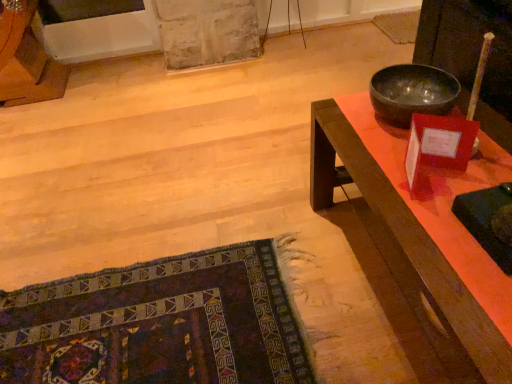
The image size is (512, 384). I want to click on wooden desk at right, so [x=424, y=232].

The height and width of the screenshot is (384, 512). Describe the element at coordinates (160, 324) in the screenshot. I see `dark woven rug at lower left` at that location.

Image resolution: width=512 pixels, height=384 pixels. I want to click on wooden desk at right, so click(x=424, y=232).

Can you tell me how much dark woven rug at lower left and shiny metallic bowl at upper right differ in facing direction?

The angle between the facing direction of dark woven rug at lower left and the facing direction of shiny metallic bowl at upper right is 179 degrees.

Would you consider dark woven rug at lower left to be distant from shiny metallic bowl at upper right?

No, dark woven rug at lower left is in close proximity to shiny metallic bowl at upper right.

Is dark woven rug at lower left bigger or smaller than shiny metallic bowl at upper right?

In the image, dark woven rug at lower left appears to be larger than shiny metallic bowl at upper right.

From the picture: Considering the sizes of dark woven rug at lower left and shiny metallic bowl at upper right in the image, is dark woven rug at lower left wider or thinner than shiny metallic bowl at upper right?

Considering their sizes, dark woven rug at lower left looks broader than shiny metallic bowl at upper right.

Consider the image. How many degrees apart are the facing directions of shiny metallic bowl at upper right and dark woven rug at lower left?

They differ by 179 degrees in their facing directions.

Is dark woven rug at lower left completely or partially inside shiny metallic bowl at upper right?

No, dark woven rug at lower left is not surrounded by shiny metallic bowl at upper right.

Where is `mat that is in front of the shiny metallic bowl at upper right`? mat that is in front of the shiny metallic bowl at upper right is located at coordinates (160, 324).

Which of these two, shiny metallic bowl at upper right or dark woven rug at lower left, stands taller?

shiny metallic bowl at upper right.

Would you say shiny metallic bowl at upper right is inside or outside wooden desk at right?

shiny metallic bowl at upper right is outside wooden desk at right.

Is shiny metallic bowl at upper right in front of wooden desk at right?

No, shiny metallic bowl at upper right is further to the viewer.

The width and height of the screenshot is (512, 384). Find the location of `desk that appears in front of the shiny metallic bowl at upper right`. desk that appears in front of the shiny metallic bowl at upper right is located at coordinates (424, 232).

From a real-world perspective, does dark woven rug at lower left sit lower than wooden desk at right?

Yes, from a real-world perspective, dark woven rug at lower left is beneath wooden desk at right.

Considering the sizes of objects dark woven rug at lower left and wooden desk at right in the image provided, who is wider, dark woven rug at lower left or wooden desk at right?

dark woven rug at lower left is wider.

This screenshot has height=384, width=512. Identify the location of desk that is on the right side of dark woven rug at lower left. (424, 232).

Which of these two, dark woven rug at lower left or wooden desk at right, is smaller?

With smaller size is dark woven rug at lower left.

Could you tell me if wooden desk at right is turned towards shiny metallic bowl at upper right?

No, wooden desk at right is not facing towards shiny metallic bowl at upper right.

From a real-world perspective, is wooden desk at right below shiny metallic bowl at upper right?

Yes.

Where is `bowl above the wooden desk at right (from the image's perspective)`? The width and height of the screenshot is (512, 384). bowl above the wooden desk at right (from the image's perspective) is located at coordinates (412, 93).

Is wooden desk at right in contact with shiny metallic bowl at upper right?

No, wooden desk at right is not touching shiny metallic bowl at upper right.

Does point (332, 202) appear closer or farther from the camera than point (312, 366)?

Point (332, 202) is farther from the camera than point (312, 366).

Who is taller, wooden desk at right or dark woven rug at lower left?

Standing taller between the two is wooden desk at right.

How different are the orientations of wooden desk at right and dark woven rug at lower left in degrees?

180 degrees separate the facing orientations of wooden desk at right and dark woven rug at lower left.

How far apart are wooden desk at right and dark woven rug at lower left?

wooden desk at right is 61.87 centimeters from dark woven rug at lower left.

At what (x,y) coordinates should I click in order to perform the action: click on mat to the left of shiny metallic bowl at upper right. Please return your answer as a coordinate pair (x, y). Looking at the image, I should click on (160, 324).

Locate an element on the screen. This screenshot has height=384, width=512. mat that appears below the shiny metallic bowl at upper right (from the image's perspective) is located at coordinates [x=160, y=324].

When comparing their distances from dark woven rug at lower left, does shiny metallic bowl at upper right or wooden desk at right seem closer?

wooden desk at right lies closer to dark woven rug at lower left than the other object.

Looking at this image, when comparing their distances from shiny metallic bowl at upper right, does dark woven rug at lower left or wooden desk at right seem further?

Based on the image, dark woven rug at lower left appears to be further to shiny metallic bowl at upper right.

Estimate the real-world distances between objects in this image. Which object is further from shiny metallic bowl at upper right, wooden desk at right or dark woven rug at lower left?

Based on the image, dark woven rug at lower left appears to be further to shiny metallic bowl at upper right.

Estimate the real-world distances between objects in this image. Which object is further from dark woven rug at lower left, wooden desk at right or shiny metallic bowl at upper right?

shiny metallic bowl at upper right lies further to dark woven rug at lower left than the other object.

From the image, which object appears to be farther from wooden desk at right, dark woven rug at lower left or shiny metallic bowl at upper right?

dark woven rug at lower left is positioned further to the anchor wooden desk at right.

When comparing their distances from wooden desk at right, does shiny metallic bowl at upper right or dark woven rug at lower left seem further?

dark woven rug at lower left lies further to wooden desk at right than the other object.

At what (x,y) coordinates should I click in order to perform the action: click on bowl situated between dark woven rug at lower left and wooden desk at right from left to right. Please return your answer as a coordinate pair (x, y). This screenshot has height=384, width=512. Looking at the image, I should click on (412, 93).